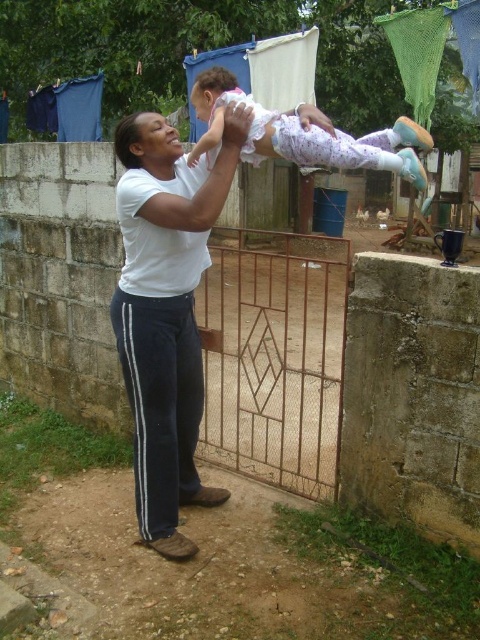
Question: Estimate the real-world distances between objects in this image. Which object is closer to the white cotton shirt at center?

Choices:
 (A) white cotton baby at upper center
 (B) rusty metal gate at center

Answer: (A)

Question: Does rusty metal gate at center have a greater width compared to white cotton baby at upper center?

Choices:
 (A) yes
 (B) no

Answer: (B)

Question: Is white cotton shirt at center thinner than white cotton baby at upper center?

Choices:
 (A) no
 (B) yes

Answer: (B)

Question: Based on their relative distances, which object is nearer to the white cotton baby at upper center?

Choices:
 (A) rusty metal gate at center
 (B) white cotton shirt at center

Answer: (B)

Question: Can you confirm if white cotton shirt at center is smaller than white cotton baby at upper center?

Choices:
 (A) no
 (B) yes

Answer: (A)

Question: Which of the following is the closest to the observer?

Choices:
 (A) white cotton shirt at center
 (B) white cotton baby at upper center
 (C) rusty metal gate at center

Answer: (B)